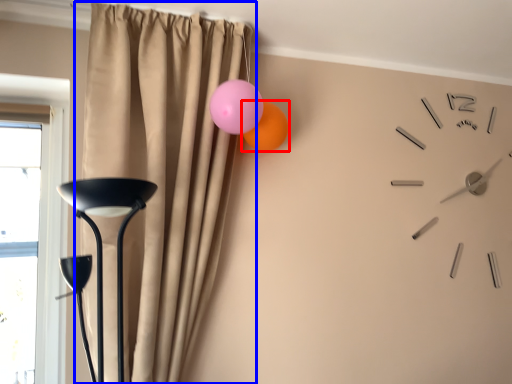
Question: Which object appears farthest to the camera in this image, balloon (highlighted by a red box) or curtain (highlighted by a blue box)?

Choices:
 (A) balloon
 (B) curtain

Answer: (A)